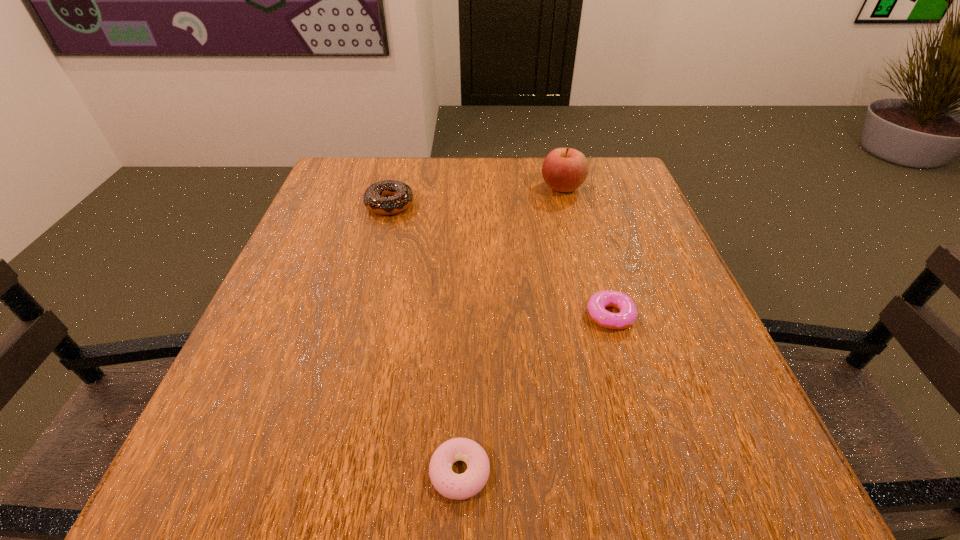
This screenshot has width=960, height=540. Identify the location of vacant region that satisfies the following two spatial constraints: 1. on the front side of the nearest doughnut; 2. on the left side of the second tallest object. (319, 472).

This screenshot has height=540, width=960. I want to click on free space that satisfies the following two spatial constraints: 1. on the back side of the leftmost object; 2. on the right side of the apple, so click(x=395, y=187).